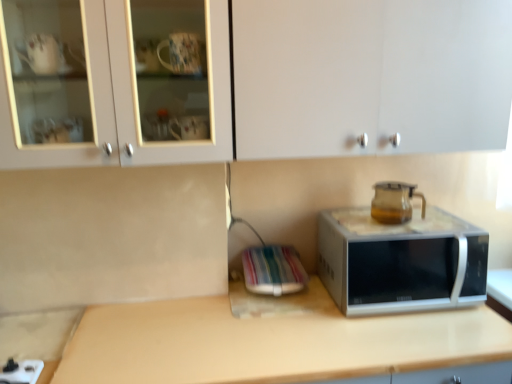
Find the location of `free space in front of silver metallic microwave at center`. free space in front of silver metallic microwave at center is located at coordinates (434, 342).